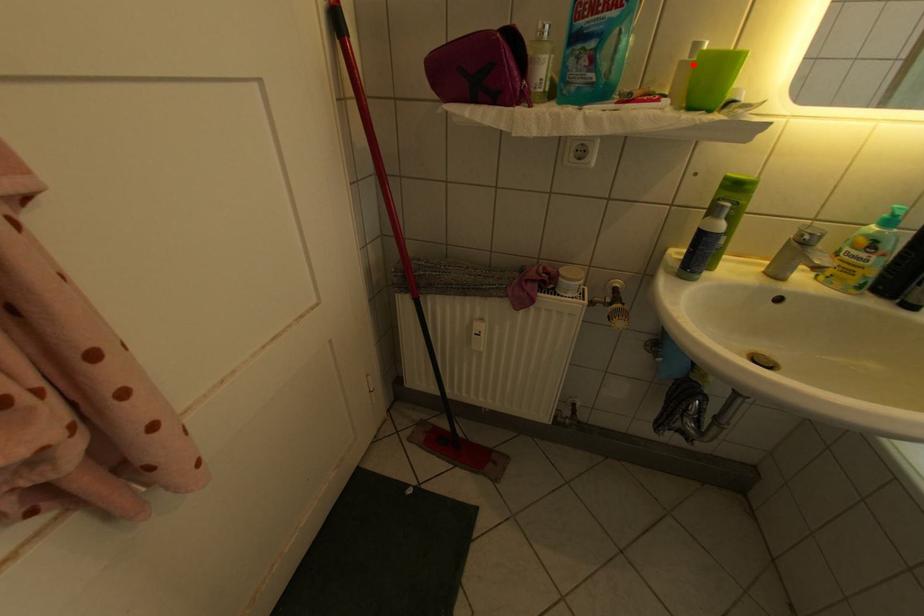
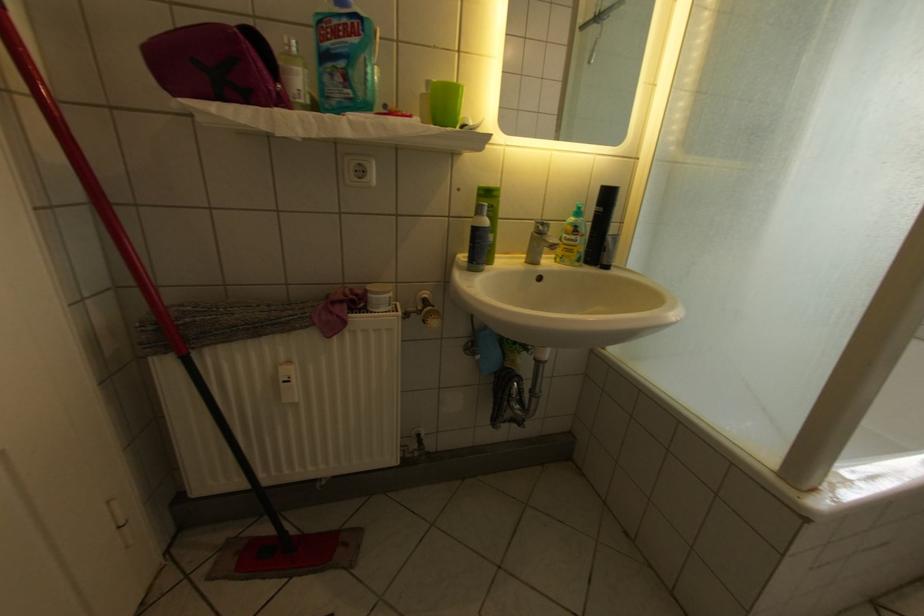
Locate, in the second image, the point that corresponds to the highlighted location in the first image.

(433, 98)